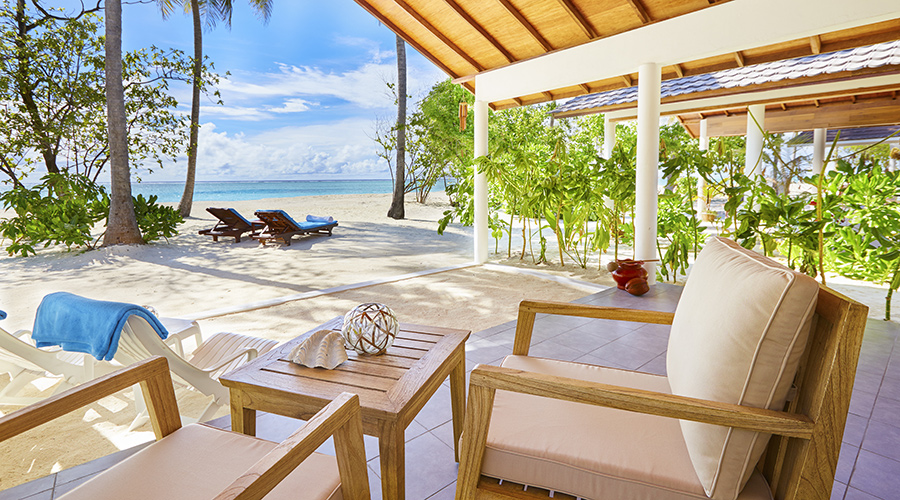
You are a GUI agent. You are given a task and a screenshot of the screen. Output one action in this format:
    pyautogui.click(x=<x>, y=<y>)
    Task: Click on the floor
    This screenshot has width=900, height=500.
    Given the screenshot: What is the action you would take?
    pyautogui.click(x=866, y=461)